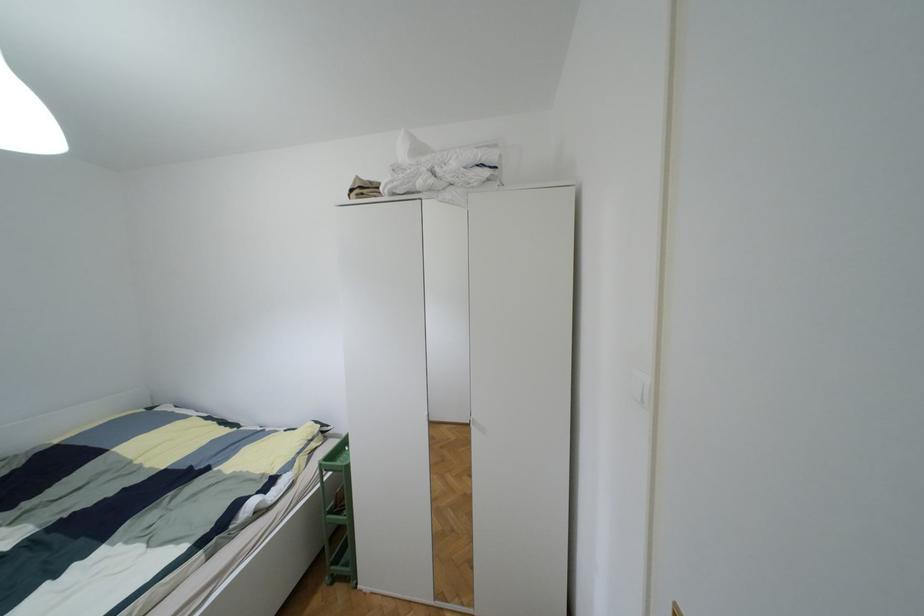
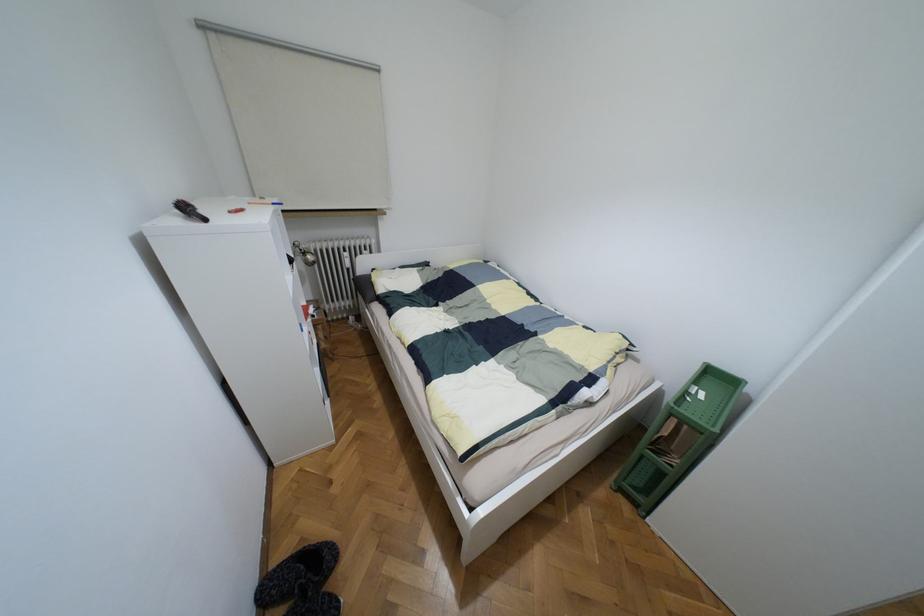
How did the camera likely rotate?

The camera's rotation is toward left-down.